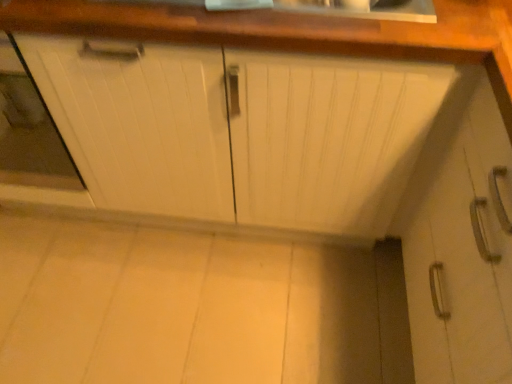
The height and width of the screenshot is (384, 512). What do you see at coordinates (460, 240) in the screenshot?
I see `white matte cabinet at lower right` at bounding box center [460, 240].

Measure the distance between point [436,114] and camera.

A distance of 3.32 feet exists between point [436,114] and camera.

You are a GUI agent. You are given a task and a screenshot of the screen. Output one action in this format:
    pyautogui.click(x=<x>, y=<y>)
    Task: Click on the white matte cabinet at lower right
    Image resolution: width=512 pixels, height=384 pixels.
    Given the screenshot: What is the action you would take?
    pyautogui.click(x=460, y=240)

Identify the location of white matte cabinet at lower right. Image resolution: width=512 pixels, height=384 pixels. (x=460, y=240).